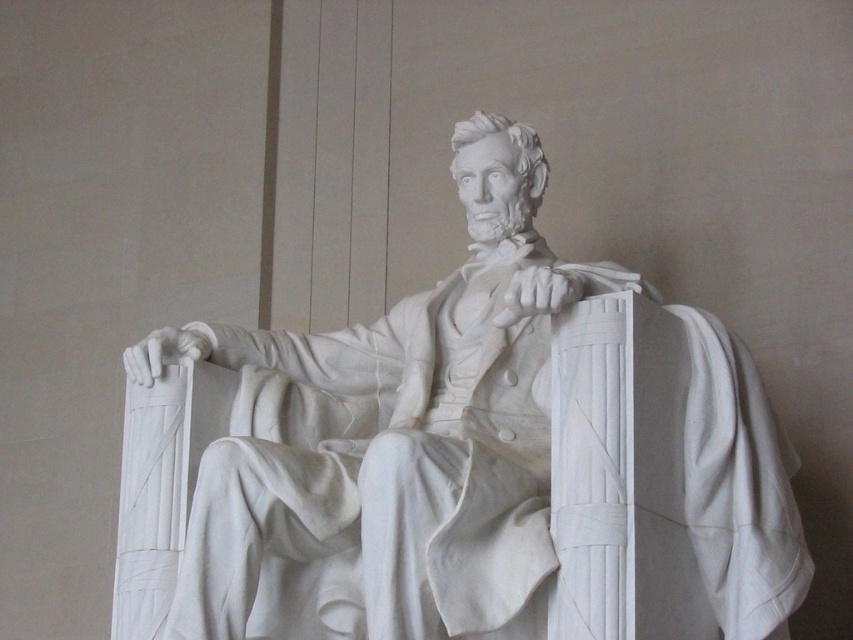
Question: Does white marble statue at center have a greater width compared to white marble book at center?

Choices:
 (A) no
 (B) yes

Answer: (B)

Question: Which of the following is the farthest from the observer?

Choices:
 (A) (566, 604)
 (B) (467, 532)

Answer: (B)

Question: Which point is closer to the camera?

Choices:
 (A) white marble statue at center
 (B) white marble book at center

Answer: (B)

Question: Is white marble statue at center thinner than white marble book at center?

Choices:
 (A) no
 (B) yes

Answer: (A)

Question: Is white marble statue at center wider than white marble book at center?

Choices:
 (A) no
 (B) yes

Answer: (B)